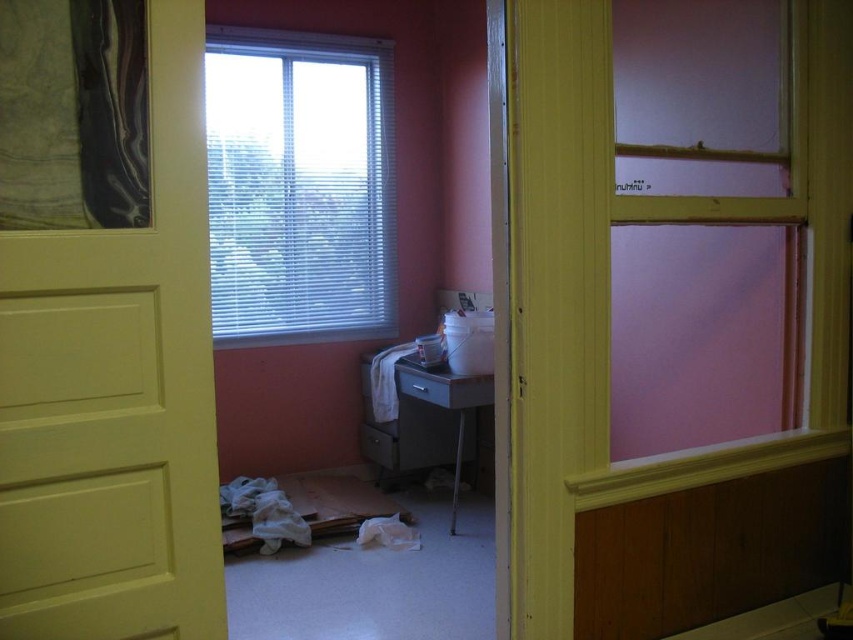
Question: Which of these objects is positioned farthest from the black marble painting at upper left?

Choices:
 (A) yellow matte door at center
 (B) white blinds at upper center

Answer: (B)

Question: Which object is closer to the camera taking this photo?

Choices:
 (A) yellow matte door at center
 (B) white blinds at upper center

Answer: (A)

Question: Is white blinds at upper center thinner than black marble painting at upper left?

Choices:
 (A) no
 (B) yes

Answer: (A)

Question: Can you confirm if yellow matte door at center is positioned to the left of white blinds at upper center?

Choices:
 (A) yes
 (B) no

Answer: (B)

Question: Which object is positioned closest to the white blinds at upper center?

Choices:
 (A) yellow matte door at center
 (B) black marble painting at upper left

Answer: (B)

Question: Is white blinds at upper center to the left of black marble painting at upper left from the viewer's perspective?

Choices:
 (A) no
 (B) yes

Answer: (A)